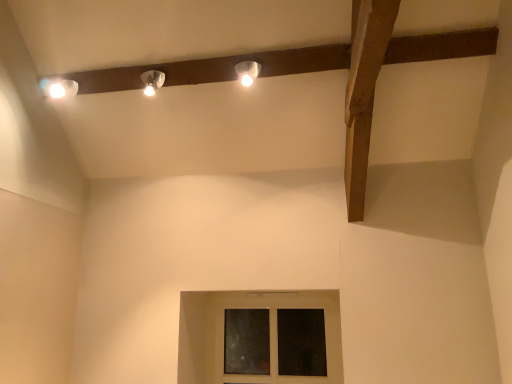
Question: Can you confirm if matte white lamp at upper center, which is the first lamp in left-to-right order, is positioned to the left of transparent glass window at center?

Choices:
 (A) yes
 (B) no

Answer: (A)

Question: Is matte white lamp at upper center, which is the first lamp in left-to-right order, next to transparent glass window at center and touching it?

Choices:
 (A) yes
 (B) no

Answer: (B)

Question: Considering the relative sizes of matte white lamp at upper center, acting as the second lamp starting from the right, and transparent glass window at center in the image provided, is matte white lamp at upper center, acting as the second lamp starting from the right, smaller than transparent glass window at center?

Choices:
 (A) no
 (B) yes

Answer: (B)

Question: Could transparent glass window at center be considered to be inside matte white lamp at upper center, acting as the second lamp starting from the right?

Choices:
 (A) no
 (B) yes

Answer: (A)

Question: Does matte white lamp at upper center, acting as the second lamp starting from the right, turn towards transparent glass window at center?

Choices:
 (A) no
 (B) yes

Answer: (A)

Question: Is matte white lamp at upper center, which is the first lamp in left-to-right order, not within transparent glass window at center?

Choices:
 (A) no
 (B) yes

Answer: (B)

Question: Is matte white lamp at upper center, which is counted as the second lamp, starting from the left, positioned behind matte white lamp at upper center, which is the first lamp in left-to-right order?

Choices:
 (A) yes
 (B) no

Answer: (B)

Question: Is matte white lamp at upper center, the 1th lamp in the right-to-left sequence, at the left side of matte white lamp at upper center, which is the first lamp in left-to-right order?

Choices:
 (A) yes
 (B) no

Answer: (B)

Question: Are matte white lamp at upper center, which is counted as the second lamp, starting from the left, and matte white lamp at upper center, acting as the second lamp starting from the right, far apart?

Choices:
 (A) no
 (B) yes

Answer: (A)

Question: Does matte white lamp at upper center, the 1th lamp in the right-to-left sequence, have a lesser width compared to matte white lamp at upper center, acting as the second lamp starting from the right?

Choices:
 (A) no
 (B) yes

Answer: (B)

Question: Considering the relative sizes of matte white lamp at upper center, which is counted as the second lamp, starting from the left, and matte white lamp at upper center, which is the first lamp in left-to-right order, in the image provided, is matte white lamp at upper center, which is counted as the second lamp, starting from the left, smaller than matte white lamp at upper center, which is the first lamp in left-to-right order,?

Choices:
 (A) no
 (B) yes

Answer: (B)

Question: Is matte white lamp at upper center, which is counted as the second lamp, starting from the left, touching matte white lamp at upper center, which is the first lamp in left-to-right order?

Choices:
 (A) no
 (B) yes

Answer: (A)

Question: Is transparent glass window at center facing towards matte white lamp at upper center, the 1th lamp in the right-to-left sequence?

Choices:
 (A) no
 (B) yes

Answer: (A)